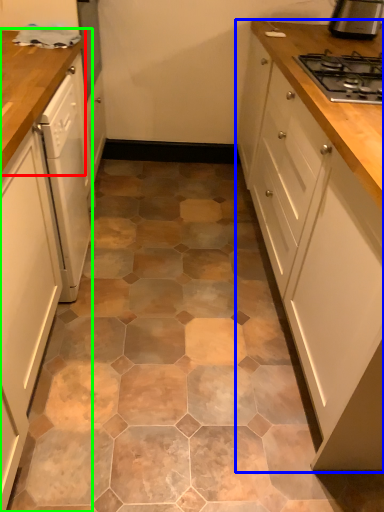
Question: Estimate the real-world distances between objects in this image. Which object is farther from countertop (highlighted by a red box), cabinetry (highlighted by a blue box) or cabinetry (highlighted by a green box)?

Choices:
 (A) cabinetry
 (B) cabinetry

Answer: (A)